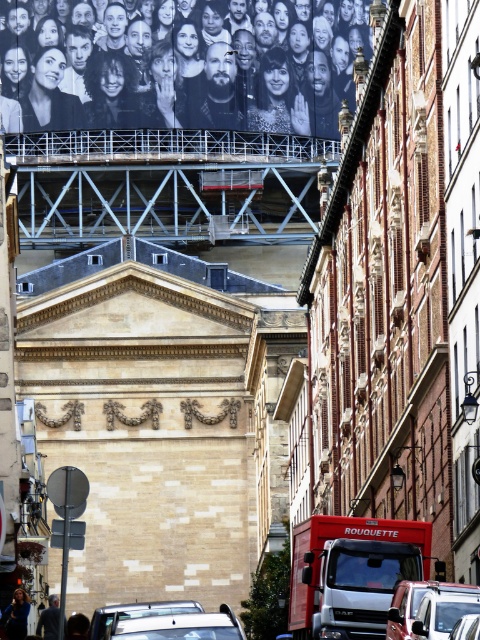
You are standing on the street in this scene. There is a point at coordinates (180, 64). What object is located at this point?

The point at coordinates (180, 64) indicates the matte black billboard at upper center.

Based on the photo, you are a delivery driver in a red matte truck at center. You need to deliver a package to the matte black billboard at upper center. Can you reach it by driving straight ahead?

The matte black billboard at upper center is 103.63 meters away from the red matte truck at center. Since the billboard is located above the classical building and the truck is on the street below, the truck cannot reach the billboard by driving straight ahead as it is positioned at a higher elevation.

You are a delivery driver who needs to park your metallic silver van at lower right as close as possible to the matte black billboard at upper center. Given that the minimum parking distance required by law is 100 meters, can you park your van closer than the legal limit?

The matte black billboard at upper center is 123.65 meters from the metallic silver van at lower right. Since the legal minimum distance is 100 meters, you cannot park the metallic silver van at lower right closer than the legal limit because it is already 23.65 meters beyond the required distance.